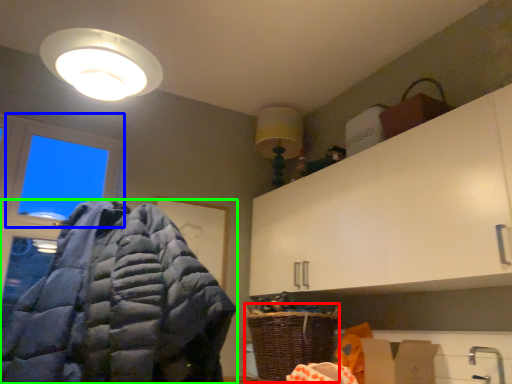
Question: Which object is the farthest from basket (highlighted by a red box)? Choose among these: window (highlighted by a blue box) or jacket (highlighted by a green box).

Choices:
 (A) window
 (B) jacket

Answer: (A)